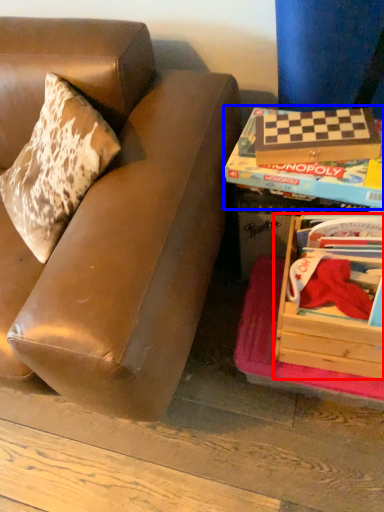
Question: Which point is further to the camera, box (highlighted by a red box) or paperback book (highlighted by a blue box)?

Choices:
 (A) box
 (B) paperback book

Answer: (B)